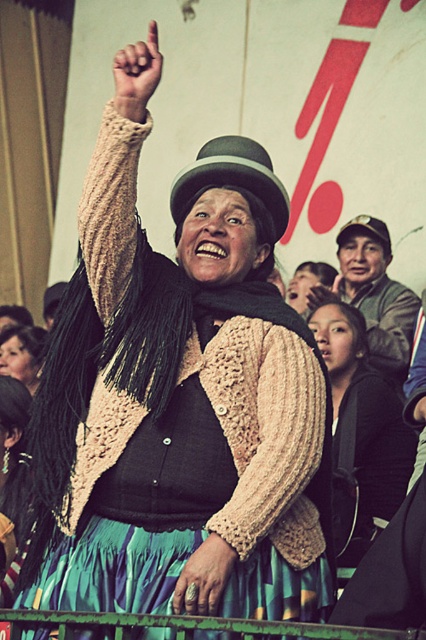
Is matte gray cap at upper right shorter than green painted metal rail at lower center?

No.

Between matte gray cap at upper right and green painted metal rail at lower center, which one is positioned lower?

green painted metal rail at lower center is below.

At what (x,y) coordinates should I click in order to perform the action: click on matte gray cap at upper right. Please return your answer as a coordinate pair (x, y). This screenshot has width=426, height=640. Looking at the image, I should click on (377, 292).

Identify the location of matte gray cap at upper right. (377, 292).

Is crochet beige sweater at center closer to the viewer compared to green felt bowler hat at center?

Yes, it is in front of green felt bowler hat at center.

Does crochet beige sweater at center appear over green felt bowler hat at center?

Actually, crochet beige sweater at center is below green felt bowler hat at center.

Image resolution: width=426 pixels, height=640 pixels. Describe the element at coordinates (259, 449) in the screenshot. I see `crochet beige sweater at center` at that location.

You are a GUI agent. You are given a task and a screenshot of the screen. Output one action in this format:
    pyautogui.click(x=<x>, y=<y>)
    Task: Click on the crochet beige sweater at center
    This screenshot has width=426, height=640.
    Given the screenshot: What is the action you would take?
    pyautogui.click(x=259, y=449)

Between green painted metal rail at lower center and matte black scarf at center, which one appears on the right side from the viewer's perspective?

matte black scarf at center

This screenshot has width=426, height=640. Describe the element at coordinates (189, 625) in the screenshot. I see `green painted metal rail at lower center` at that location.

At what (x,y) coordinates should I click in order to perform the action: click on green painted metal rail at lower center. Please return your answer as a coordinate pair (x, y). The width and height of the screenshot is (426, 640). Looking at the image, I should click on (189, 625).